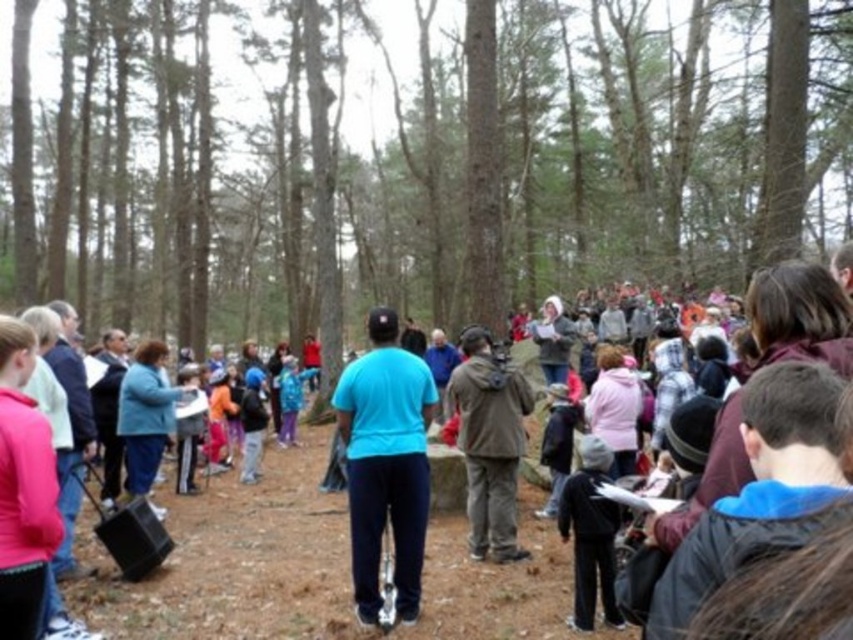
Question: Which object is farther from the camera taking this photo?

Choices:
 (A) blue matte shirt at center
 (B) blue fleece jacket at center

Answer: (B)

Question: Among these objects, which one is nearest to the camera?

Choices:
 (A) blue cotton shirt at center
 (B) blue matte shirt at center
 (C) brown fabric camera at center
 (D) brown textured tree at center

Answer: (A)

Question: Considering the relative positions of blue cotton shirt at center and blue matte shirt at center in the image provided, where is blue cotton shirt at center located with respect to blue matte shirt at center?

Choices:
 (A) below
 (B) above

Answer: (A)

Question: Is the position of blue cotton shirt at center more distant than that of blue matte shirt at center?

Choices:
 (A) no
 (B) yes

Answer: (A)

Question: Which of the following is the farthest from the observer?

Choices:
 (A) blue cotton shirt at center
 (B) dark gray fleece jacket at lower center
 (C) brown textured tree at center

Answer: (C)

Question: Does brown textured tree at center appear on the left side of blue matte shirt at center?

Choices:
 (A) no
 (B) yes

Answer: (B)